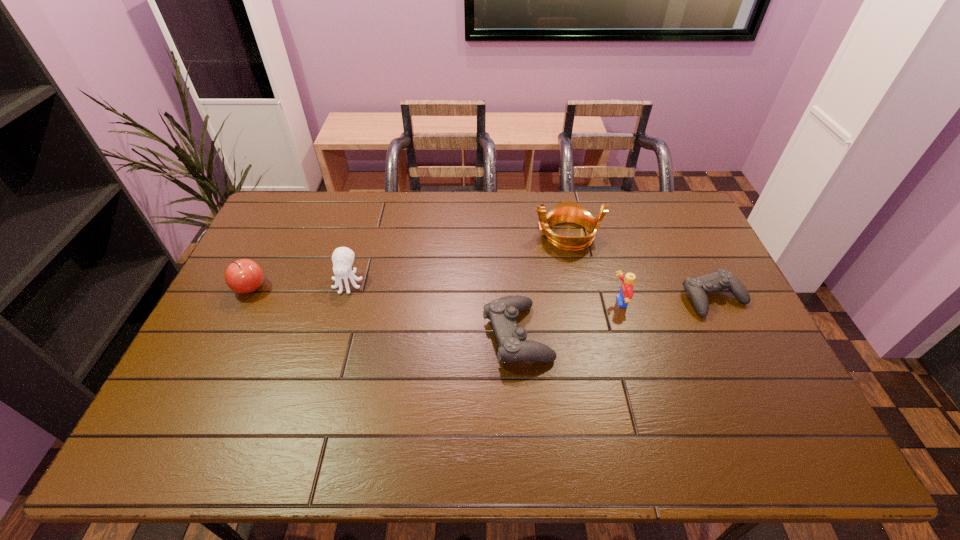
Locate an element on the screen. The width and height of the screenshot is (960, 540). free space that satisfies the following two spatial constraints: 1. on the front-facing side of the second object from left to right; 2. on the left side of the left control is located at coordinates (333, 335).